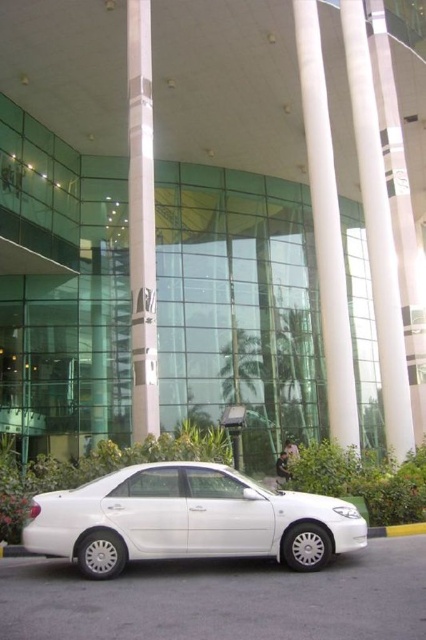
Which is more to the right, white glossy pillar at center or gray concrete curb at lower right?

From the viewer's perspective, gray concrete curb at lower right appears more on the right side.

Is point (137, 419) farther from viewer compared to point (402, 524)?

That is True.

The image size is (426, 640). Describe the element at coordinates (141, 221) in the screenshot. I see `white glossy pillar at center` at that location.

This screenshot has height=640, width=426. What are the coordinates of `white glossy pillar at center` in the screenshot? It's located at (141, 221).

Is white glossy sedan at lower center to the right of white glossy pillar at center from the viewer's perspective?

Correct, you'll find white glossy sedan at lower center to the right of white glossy pillar at center.

Identify the location of white glossy sedan at lower center. (187, 518).

Is white smooth pillar at center bigger than white glossy pillar at center?

Correct, white smooth pillar at center is larger in size than white glossy pillar at center.

Is the position of white smooth pillar at center less distant than that of white glossy pillar at center?

No, white smooth pillar at center is further to the viewer.

Between point (336, 388) and point (132, 145), which one is positioned behind?

The point (132, 145) is more distant.

Identify the location of white smooth pillar at center. (325, 228).